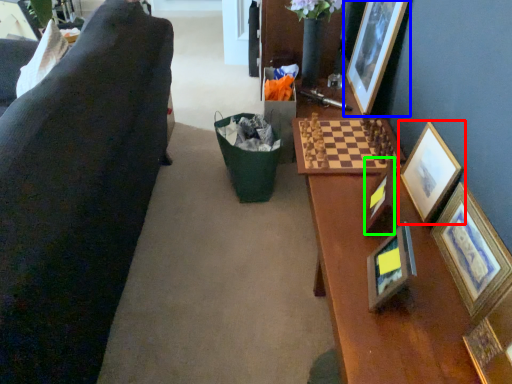
Question: Estimate the real-world distances between objects in this image. Which object is closer to picture frame (highlighted by a red box), picture frame (highlighted by a blue box) or picture frame (highlighted by a green box)?

Choices:
 (A) picture frame
 (B) picture frame

Answer: (B)